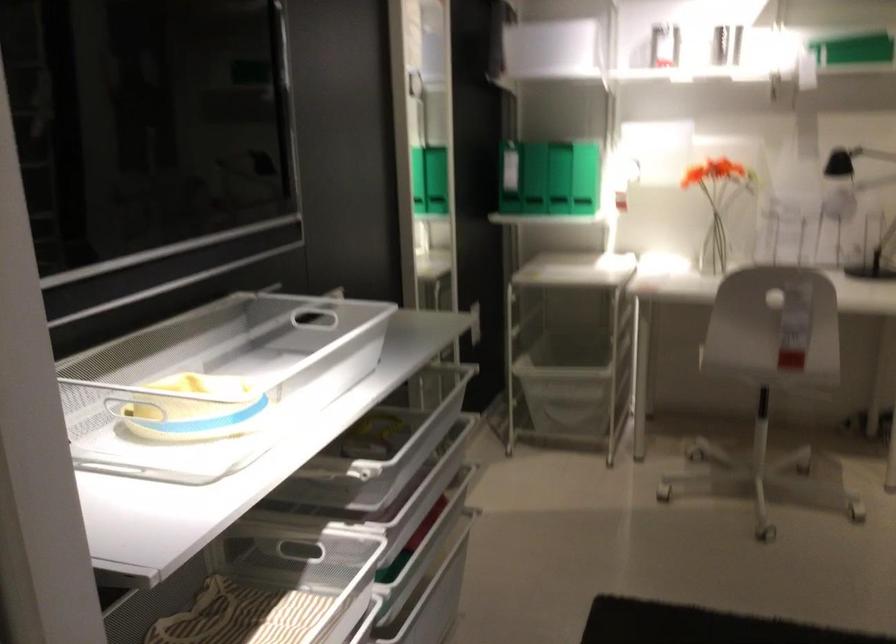
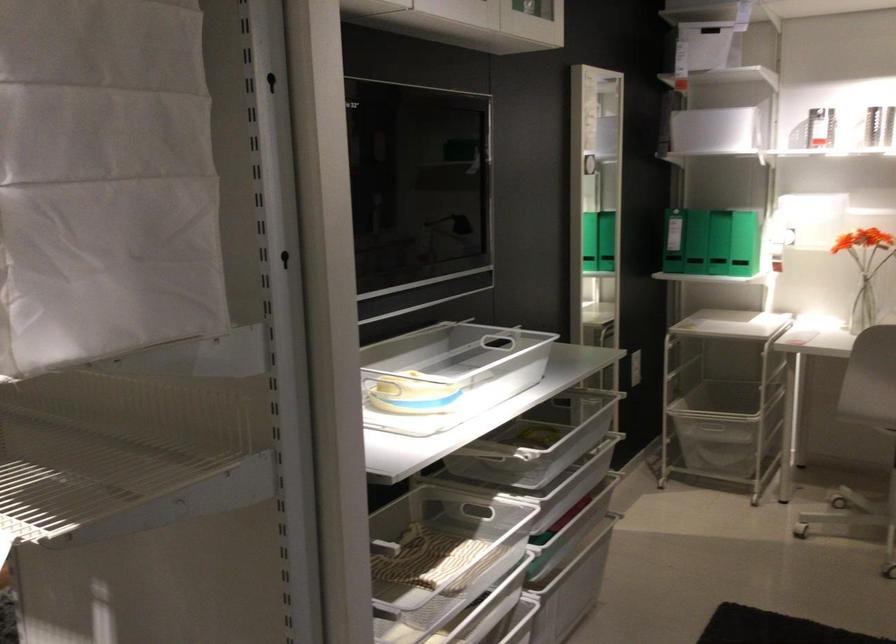
Where in the second image is the point corresponding to (571,185) from the first image?

(745, 243)